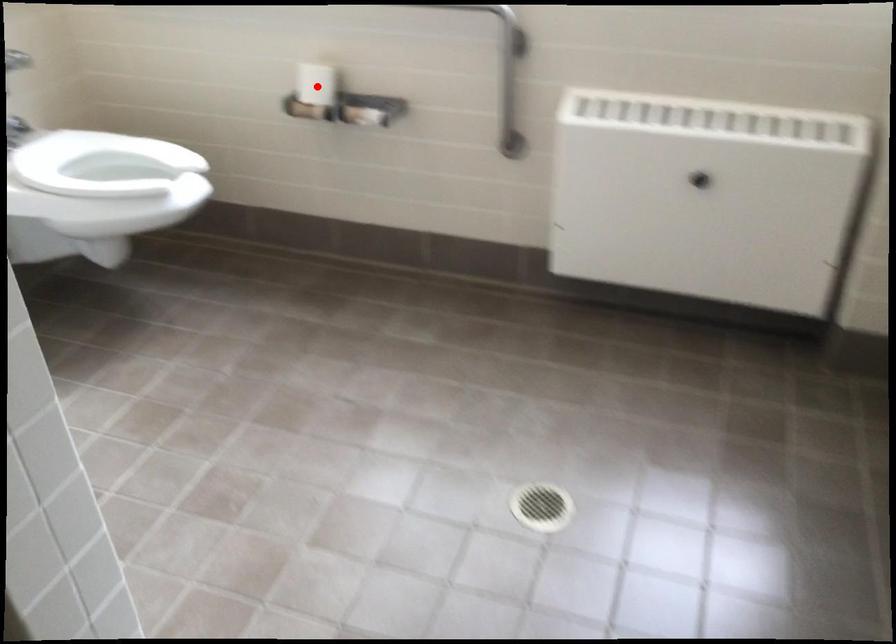
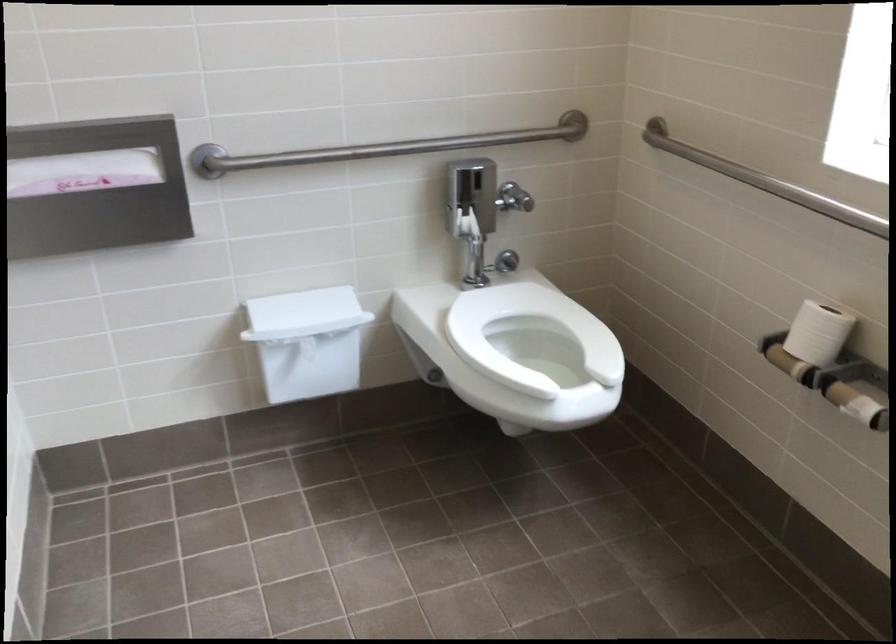
Question: I am providing you with two images of the same scene from different viewpoints. A red point is shown in image1. For the corresponding object point in image2, is it positioned nearer or farther from the camera?

Choices:
 (A) Nearer
 (B) Farther

Answer: (A)